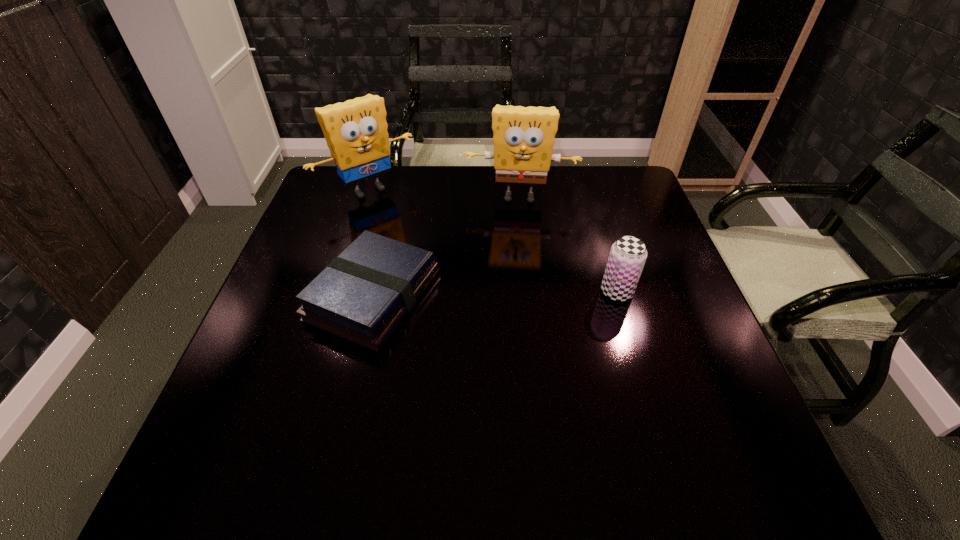
The width and height of the screenshot is (960, 540). What are the coordinates of `the closest object to the book` in the screenshot? It's located at (356, 133).

Select which object is the closest to the left sponge. Please provide its 2D coordinates. Your answer should be formatted as a tuple, i.e. [(x, y)], where the tuple contains the x and y coordinates of a point satisfying the conditions above.

[(523, 137)]

You are a GUI agent. You are given a task and a screenshot of the screen. Output one action in this format:
    pyautogui.click(x=<x>, y=<y>)
    Task: Click on the free space that satisfies the following two spatial constraints: 1. on the front side of the rightmost object; 2. on the right side of the second object from right to left
    The width and height of the screenshot is (960, 540).
    Given the screenshot: What is the action you would take?
    tap(530, 292)

Where is `vacant space that satisfies the following two spatial constraints: 1. on the back side of the book; 2. on the left side of the beer can`? vacant space that satisfies the following two spatial constraints: 1. on the back side of the book; 2. on the left side of the beer can is located at coordinates (374, 292).

Identify the location of vacant space that satisfies the following two spatial constraints: 1. on the back side of the shortest object; 2. on the left side of the second shortest object. This screenshot has height=540, width=960. (374, 292).